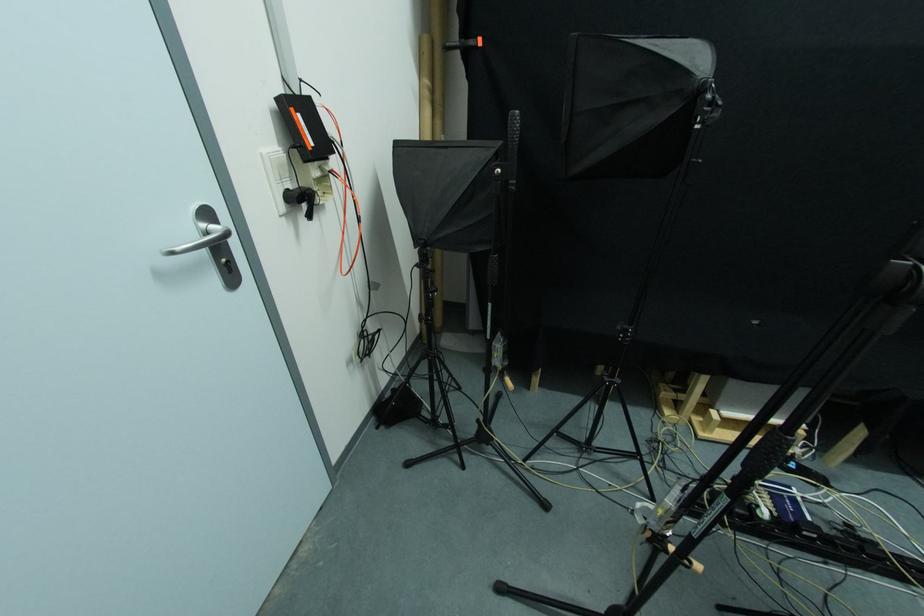
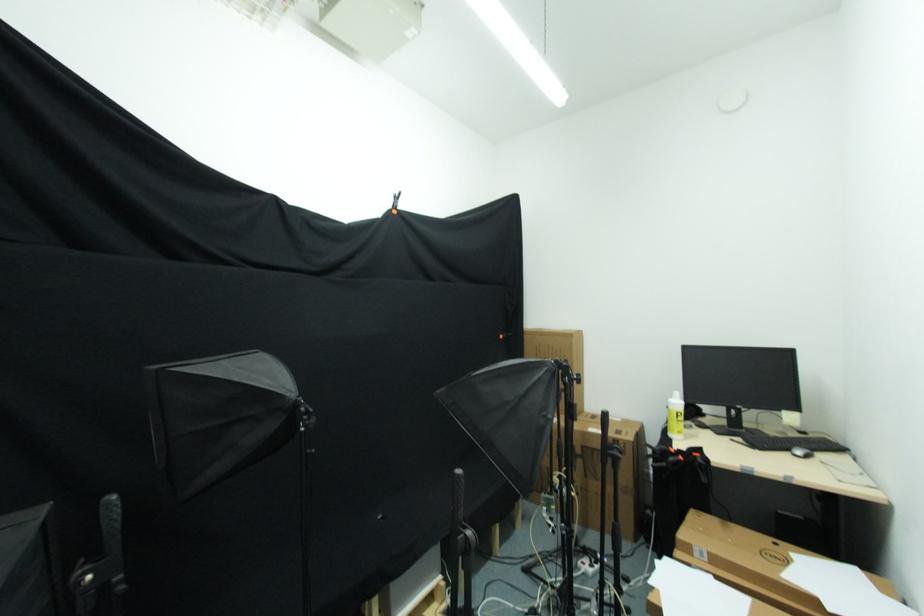
Question: How did the camera likely rotate?

Choices:
 (A) Left
 (B) Right
 (C) Up
 (D) Down

Answer: (B)